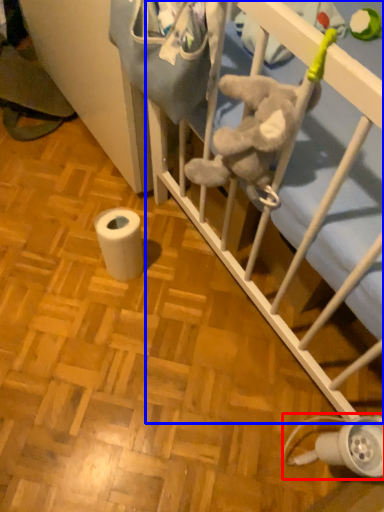
Question: Which point is further to the camera, lamp (highlighted by a red box) or infant bed (highlighted by a blue box)?

Choices:
 (A) lamp
 (B) infant bed

Answer: (B)